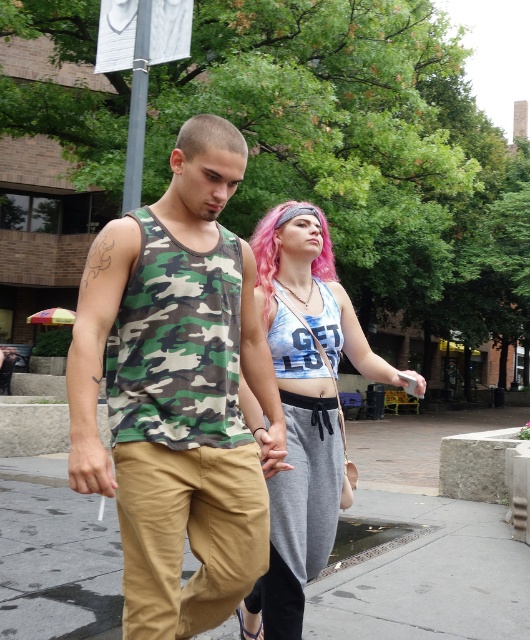
Question: Which point is farther from the camera taking this photo?

Choices:
 (A) (253, 628)
 (B) (40, 620)
 (C) (76, 362)
 (D) (254, 248)

Answer: (B)

Question: Can you confirm if blue tie-dye tank top at center is wider than shaved head at center?

Choices:
 (A) yes
 (B) no

Answer: (A)

Question: Can you confirm if blue tie-dye tank top at center is thinner than pink dyed hair at center?

Choices:
 (A) no
 (B) yes

Answer: (B)

Question: Among these objects, which one is nearest to the camera?

Choices:
 (A) camouflage fabric tank top at center
 (B) brown concrete pavement at lower center

Answer: (A)

Question: Can you confirm if blue tie-dye tank top at center is positioned to the right of shaved head at center?

Choices:
 (A) yes
 (B) no

Answer: (A)

Question: Estimate the real-world distances between objects in this image. Which object is closer to the pink dyed hair at center?

Choices:
 (A) shaved head at center
 (B) camouflage fabric tank top at center
 (C) brown concrete pavement at lower center
 (D) blue tie-dye tank top at center

Answer: (B)